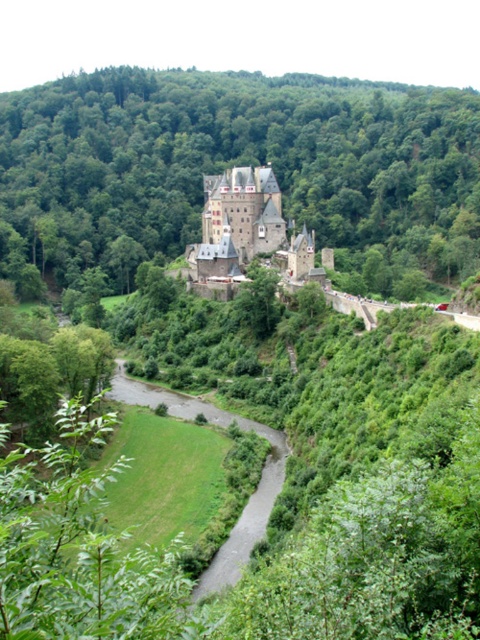
You are an architect planning to build a small garden between the green leafy tree at center and the stone medieval castle at center. Which object has a wider base to consider for space planning?

The green leafy tree at center has a larger width than the stone medieval castle at center, so its wider base should be considered for space planning.

In the scene shown: You are an artist planning to paint the scene. You want to emphasize the green leafy tree at center and the stone medieval castle at center. Which object should you paint larger to make it stand out more?

The green leafy tree at center is larger in size than the stone medieval castle at center, so painting the green leafy tree at center larger will make it stand out more.

You are an architect designing a new garden path. The green leafy tree at center is located at coordinate point 0.258, 0.500. If you want to place a bench exactly 0.1 units to the right of the tree, what would be the new coordinate point for the bench?

The bench should be placed at coordinate point (240, 228) since adding 0.1 to the x coordinate of the green leafy tree at center at (240, 164) gives (240, 228).